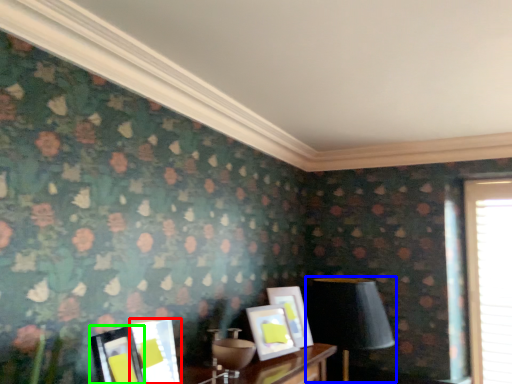
Question: Considering the real-world distances, which object is closest to picture frame (highlighted by a red box)? table lamp (highlighted by a blue box) or picture frame (highlighted by a green box).

Choices:
 (A) table lamp
 (B) picture frame

Answer: (B)